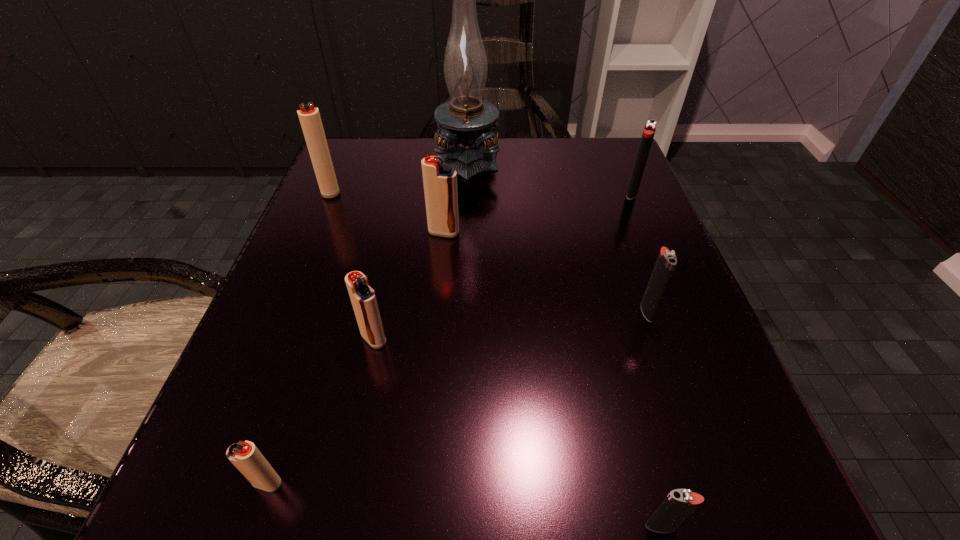
Locate an element on the screen. the farthest object is located at coordinates (467, 123).

Find the location of a particular element. oil lamp is located at coordinates (467, 123).

The image size is (960, 540). I want to click on the farthest red igniter, so click(310, 120).

I want to click on the leftmost igniter, so click(x=310, y=120).

Where is `the rightmost red igniter`? Image resolution: width=960 pixels, height=540 pixels. the rightmost red igniter is located at coordinates (440, 181).

Where is `the fifth nearest object`? The image size is (960, 540). the fifth nearest object is located at coordinates (440, 181).

I want to click on the rightmost igniter, so click(x=650, y=127).

Find the location of a particular element. the biggest black igniter is located at coordinates (650, 127).

This screenshot has width=960, height=540. In order to click on the second smallest black igniter in this screenshot , I will do `click(666, 261)`.

Where is `the fourth nearest object`? The width and height of the screenshot is (960, 540). the fourth nearest object is located at coordinates (666, 261).